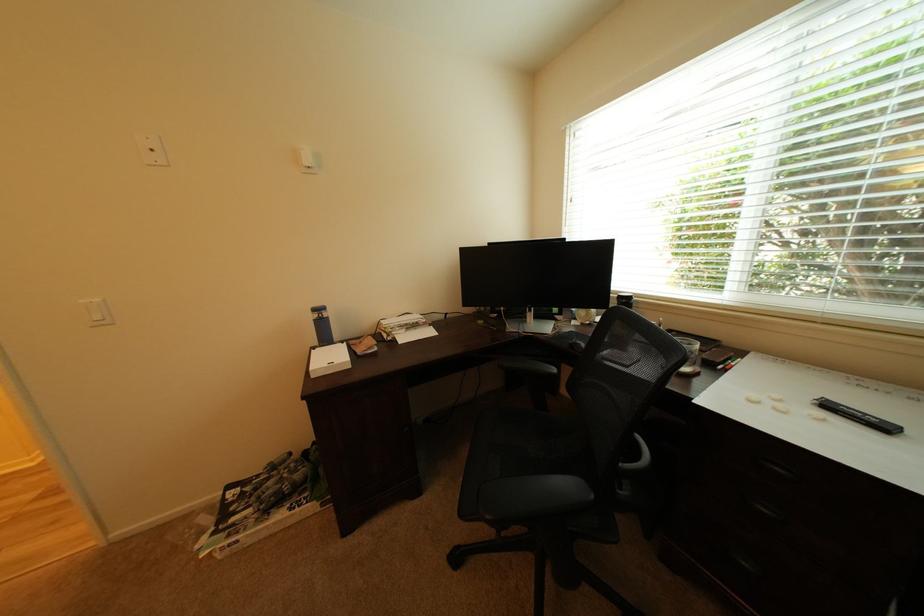
Describe the element at coordinates (152, 150) in the screenshot. I see `the white light switch` at that location.